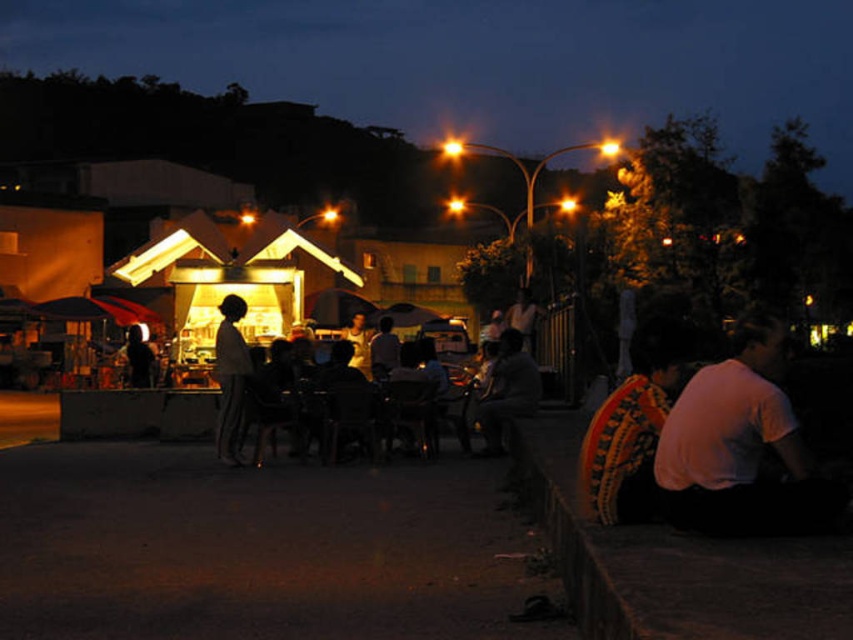
You are a photographer at the event and want to capture both the white matte shirt at lower right and the silhouette fabric at center in a single photo. Which object will appear larger in the photo?

The white matte shirt at lower right will appear larger in the photo because it is closer to the viewer than the silhouette fabric at center.

You are a photographer standing at the edge of the gathering. You want to take a photo that includes both the white matte shirt at lower right and the silhouette fabric at center. Given that your camera has a maximum focus range of 8 meters, will you be able to capture both subjects in focus without moving your position?

The distance between the white matte shirt at lower right and the silhouette fabric at center is 7.80 meters. Since your camera can focus up to 8 meters, you can capture both subjects in focus without moving.

From the picture: You are standing at point (x=238, y=403) and want to walk to point (x=698, y=424). Is the destination point in front of you or behind you?

The destination point (x=698, y=424) is in front of point (x=238, y=403), so it is in front of you.